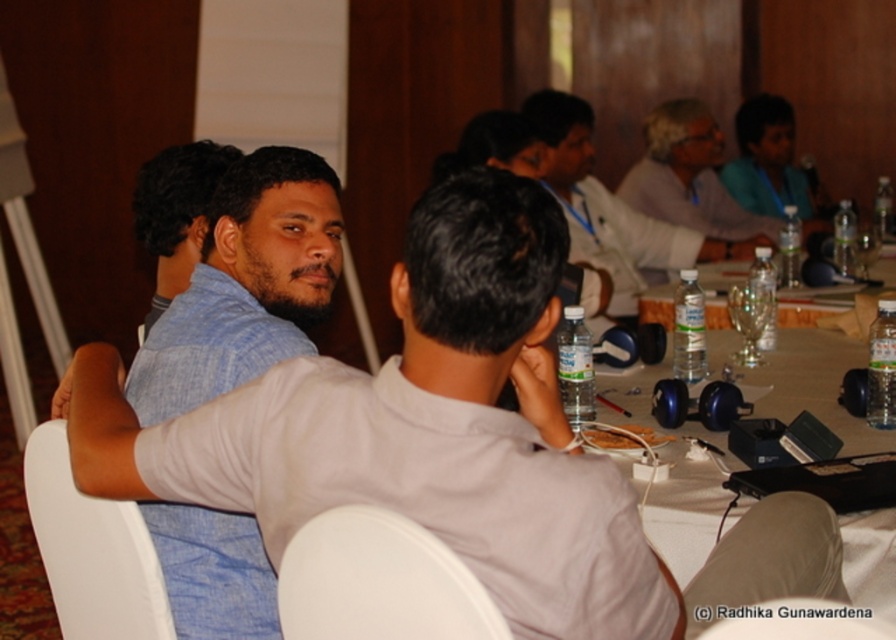
You are standing in the conference room and want to place a small plant between the two points labeled point (558, 100) and point (707, 189). Since the plant needs to be closer to the camera, which point should you position it near?

You should position the plant near point (558, 100) because it is closer to the camera compared to point (707, 189).

You are organizing a small event and need to place a 1.5 meter long banner on the table. Given the size of the blue denim shirt at left and the white plastic table at center, is there enough space on the table to place the banner without moving any existing items?

The blue denim shirt at left has a smaller size compared to the white plastic table at center, so the table is large enough to accommodate a 1.5 meter banner without moving existing items.

You are sitting at the table and want to pass a document to the person at point (244, 284). Which person should you hand it to?

The blue denim shirt at left is located at point (244, 284), so you should hand the document to the blue denim shirt at left.